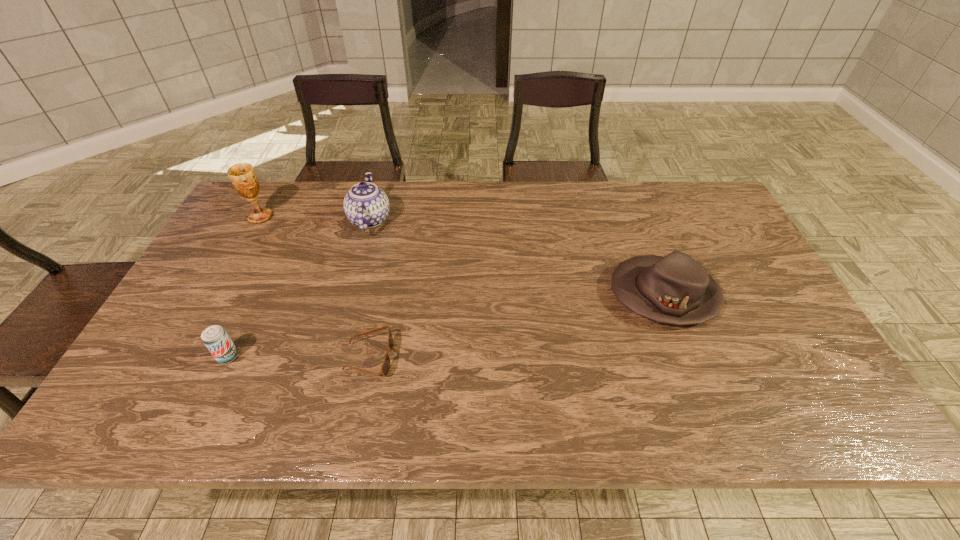
Where is `vacant region between the hat and the second object from left to right`? vacant region between the hat and the second object from left to right is located at coordinates (445, 326).

Locate an element on the screen. The width and height of the screenshot is (960, 540). vacant area that lies between the beer can and the shortest object is located at coordinates click(x=299, y=357).

I want to click on unoccupied position between the shortest object and the rightmost object, so click(x=516, y=326).

Locate an element on the screen. This screenshot has width=960, height=540. unoccupied area between the leftmost object and the second tallest object is located at coordinates (315, 218).

At what (x,y) coordinates should I click in order to perform the action: click on vacant space in between the shortest object and the rightmost object. Please return your answer as a coordinate pair (x, y). Image resolution: width=960 pixels, height=540 pixels. Looking at the image, I should click on click(516, 326).

Find the location of a particular element. empty space that is in between the rightmost object and the chalice is located at coordinates (462, 256).

Find the location of a particular element. Image resolution: width=960 pixels, height=540 pixels. vacant area that lies between the tallest object and the chinaware is located at coordinates (315, 218).

Choose which object is the third nearest neighbor to the leftmost object. Please provide its 2D coordinates. Your answer should be formatted as a tuple, i.e. [(x, y)], where the tuple contains the x and y coordinates of a point satisfying the conditions above.

[(385, 368)]

Locate an element on the screen. This screenshot has height=540, width=960. object identified as the third closest to the second tallest object is located at coordinates (215, 338).

Find the location of `vacant position in the image that satisfies the following two spatial constraints: 1. on the decorative side of the rightmost object; 2. on the front side of the beer can`. vacant position in the image that satisfies the following two spatial constraints: 1. on the decorative side of the rightmost object; 2. on the front side of the beer can is located at coordinates (687, 356).